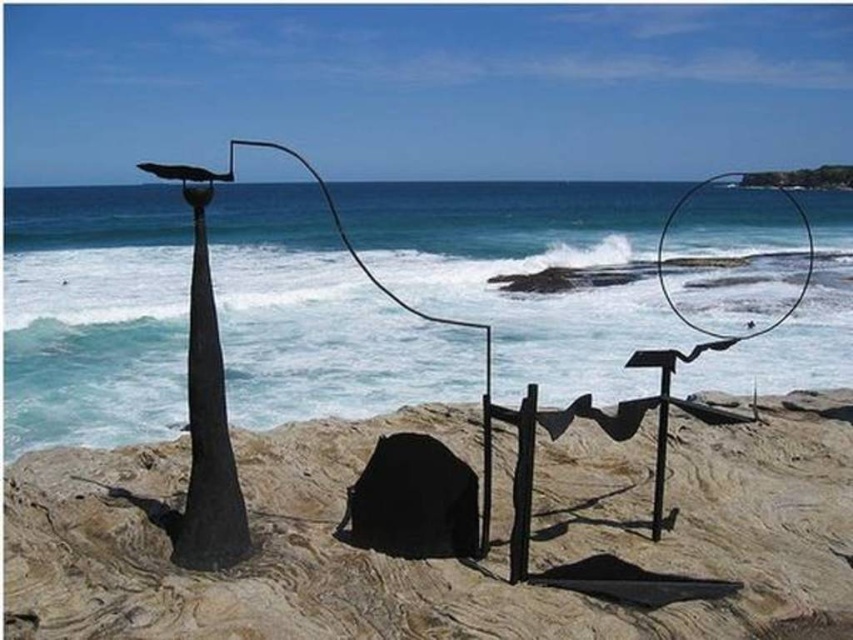
You are a photographer planning to capture the sculpture and its surroundings. You want to ensure that the smooth sand at center and the black matte pole at left are both visible in your shot. Given their sizes, which object will occupy more space in the photo?

The smooth sand at center has a larger size compared to the black matte pole at left, so it will occupy more space in the photo.

You are standing on the rocky beach and want to place a 3 feet wide sculpture base on the sand. Can you fit it on the smooth sand at center?

The smooth sand at center is 8.70 feet from viewer. Since the sculpture base is only 3 feet wide, it will fit comfortably on the smooth sand at center as the space available is more than sufficient.